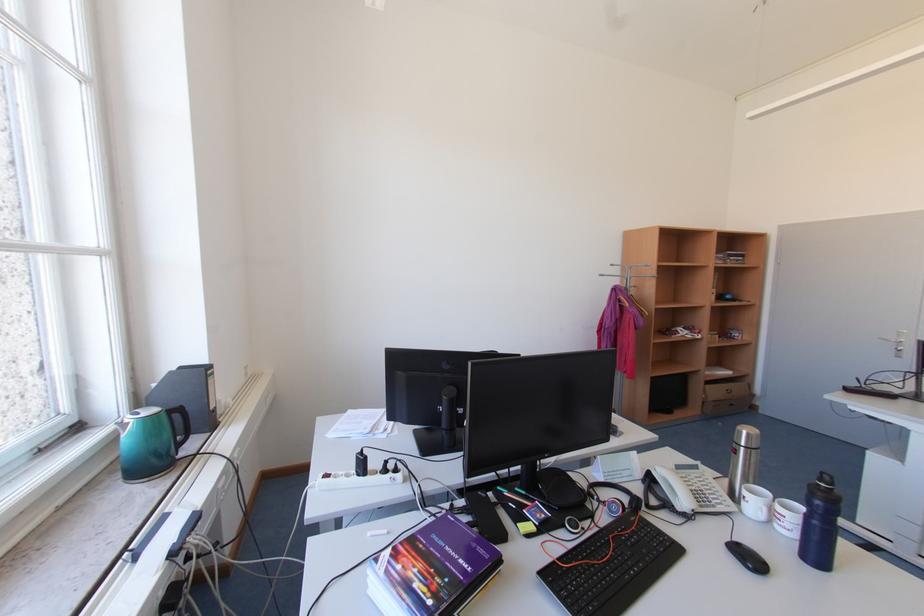
Find where to lift the silver thermos. Please return your answer as a coordinate pair (x, y).

(743, 460)